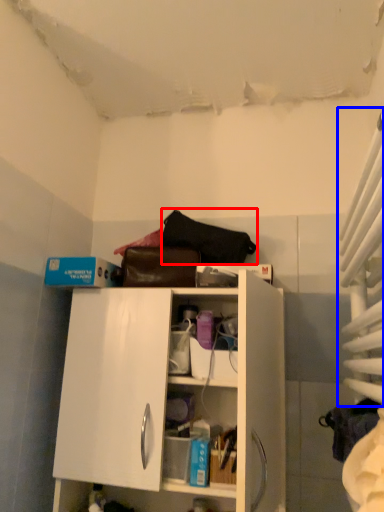
Question: Which point is closer to the camera, handbag (highlighted by a red box) or curtain (highlighted by a blue box)?

Choices:
 (A) handbag
 (B) curtain

Answer: (B)